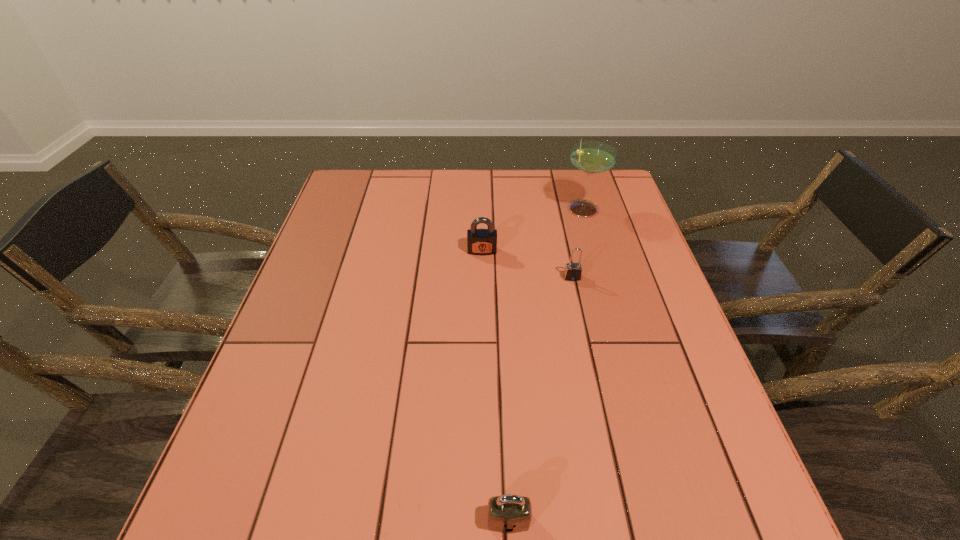
Image resolution: width=960 pixels, height=540 pixels. What are the coordinates of `free space between the third farthest object and the second farthest object` in the screenshot? It's located at (527, 264).

Where is `unoccupied area between the nearest object and the second nearest object`? unoccupied area between the nearest object and the second nearest object is located at coordinates (540, 399).

The width and height of the screenshot is (960, 540). Identify the location of empty location between the nearest object and the rightmost padlock. (540, 399).

Identify the location of vacant area between the tallest object and the third nearest object. The height and width of the screenshot is (540, 960). (533, 229).

The image size is (960, 540). In order to click on empty space between the second farthest object and the nearest object in this screenshot , I will do `click(495, 386)`.

Identify the location of free space between the tallest object and the third nearest object. click(533, 229).

Where is `free space between the farthest object and the nearest padlock`? Image resolution: width=960 pixels, height=540 pixels. free space between the farthest object and the nearest padlock is located at coordinates (545, 363).

You are a GUI agent. You are given a task and a screenshot of the screen. Output one action in this format:
    pyautogui.click(x=<x>, y=<y>)
    Task: Click on the object identified as the closest to the farthest padlock
    
    Given the screenshot: What is the action you would take?
    pyautogui.click(x=573, y=271)

Where is `object that can be found as the closest to the farthest object`? object that can be found as the closest to the farthest object is located at coordinates (573, 271).

This screenshot has width=960, height=540. Identify the location of padlock object that ranks as the closest to the farthest padlock. (573, 271).